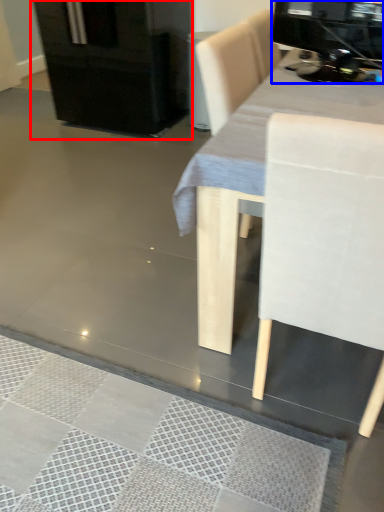
Question: Which object is closer to the camera taking this photo, fridge (highlighted by a red box) or appliance (highlighted by a blue box)?

Choices:
 (A) fridge
 (B) appliance

Answer: (B)